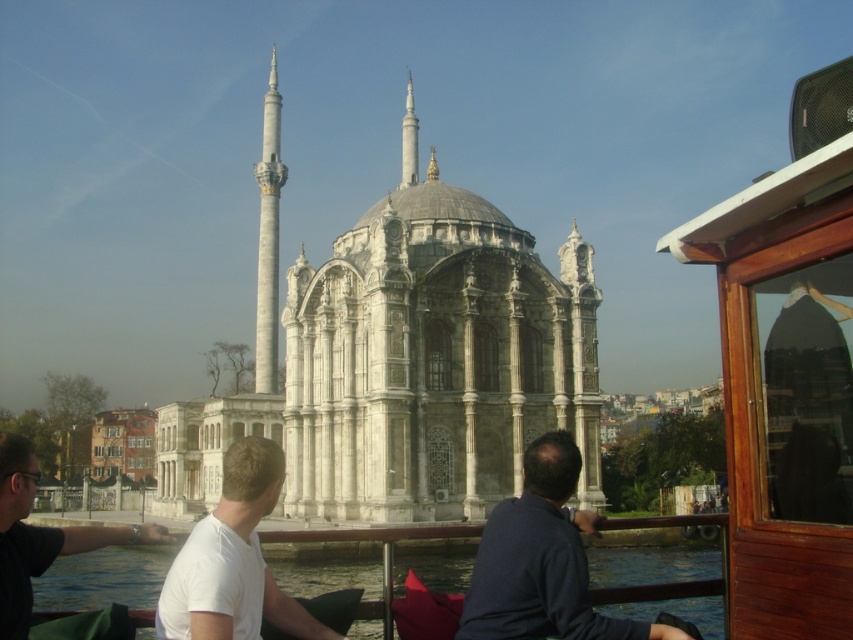
Does blue water at lower left come behind white matte shirt at center?

Yes, blue water at lower left is further from the viewer.

Can you confirm if blue water at lower left is thinner than white matte shirt at center?

In fact, blue water at lower left might be wider than white matte shirt at center.

Describe the element at coordinates (103, 579) in the screenshot. I see `blue water at lower left` at that location.

The height and width of the screenshot is (640, 853). What are the coordinates of `blue water at lower left` in the screenshot? It's located at (103, 579).

Does dark blue sweater at center appear on the right side of white matte shirt at lower left?

Indeed, dark blue sweater at center is positioned on the right side of white matte shirt at lower left.

From the picture: Is dark blue sweater at center closer to camera compared to white matte shirt at lower left?

No, it is behind white matte shirt at lower left.

Identify the location of dark blue sweater at center. (541, 561).

Identify the location of dark blue sweater at center. (541, 561).

What do you see at coordinates (103, 579) in the screenshot? I see `blue water at lower left` at bounding box center [103, 579].

Is blue water at lower left bigger than white matte shirt at lower left?

Correct, blue water at lower left is larger in size than white matte shirt at lower left.

This screenshot has height=640, width=853. I want to click on blue water at lower left, so click(103, 579).